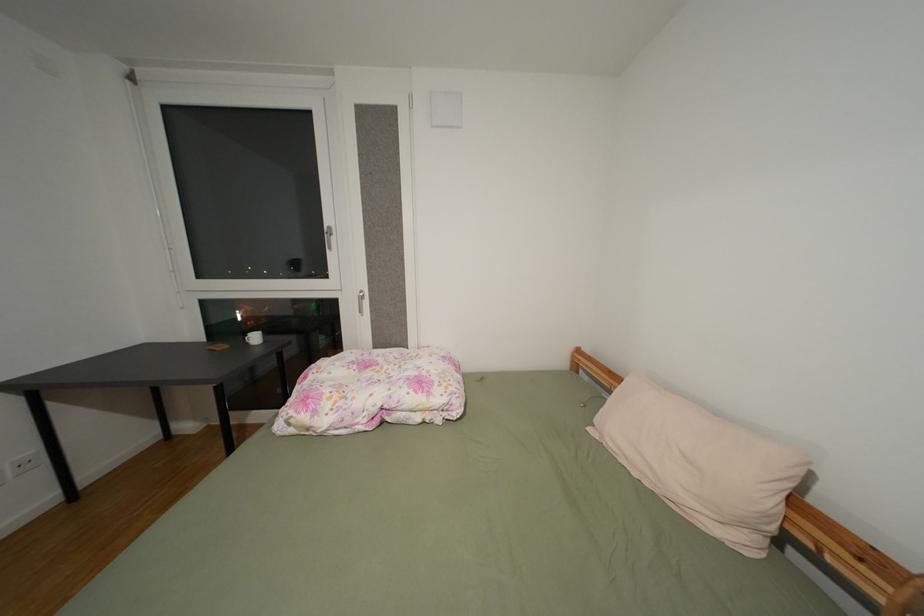
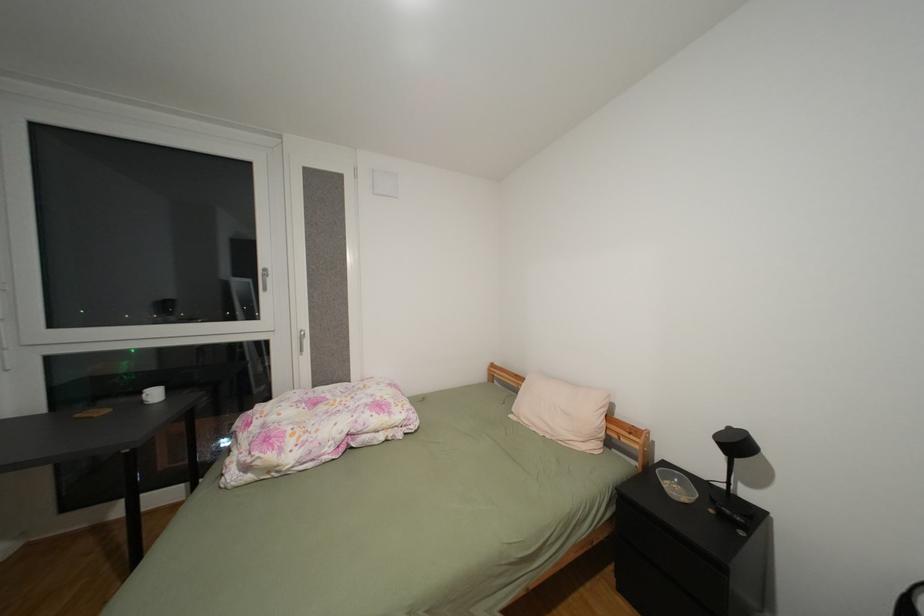
Question: The images are taken continuously from a first-person perspective. In which direction is your viewpoint rotating?

Choices:
 (A) Left
 (B) Right
 (C) Up
 (D) Down

Answer: (B)